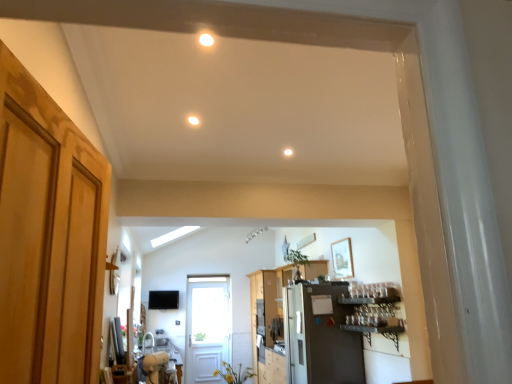
Question: In terms of width, does white matte light fixture at center, the 3th lighting from the front, look wider or thinner when compared to matte white light fixture at center, which is the 2th lighting in front-to-back order?

Choices:
 (A) wide
 (B) thin

Answer: (B)

Question: Would you say white matte light fixture at center, placed as the 3th lighting when sorted from top to bottom, is to the left or to the right of matte white light fixture at center, positioned as the 2th lighting in bottom-to-top order, in the picture?

Choices:
 (A) left
 (B) right

Answer: (B)

Question: Which object is the closest to the matte white light fixture at center, the first lighting in the left-to-right sequence?

Choices:
 (A) white glossy sink at lower left
 (B) white wooden door at center, the 1th door in the bottom-to-top sequence
 (C) wooden cabinet at center
 (D) white matte light fixture at center, placed as the 3th lighting when sorted from top to bottom
 (E) satin silver refrigerator at center

Answer: (D)

Question: Which object is the closest to the satin silver refrigerator at center?

Choices:
 (A) white matte light fixture at center, the third lighting viewed from the left
 (B) white glossy sink at lower left
 (C) matte white light fixture at center, the first lighting in the left-to-right sequence
 (D) white glossy light fixture at upper center, the third lighting ordered from the bottom
 (E) light brown wood door at left, the first door in the front-to-back sequence

Answer: (B)